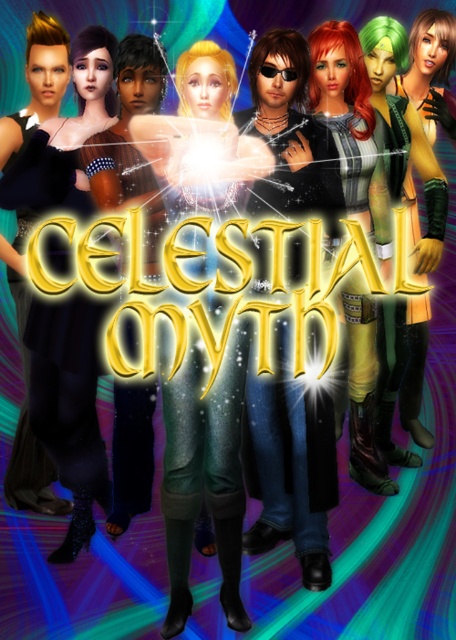
Is shiny black leather jacket at center above shiny red hair at center?

No.

Does point (316, 577) come behind point (315, 61)?

No.

Does point (305, 97) come in front of point (362, 310)?

Yes, point (305, 97) is closer to viewer.

Image resolution: width=456 pixels, height=640 pixels. Find the location of `shiny black leather jacket at center`. shiny black leather jacket at center is located at coordinates (290, 467).

Does green matte boots at center appear on the left side of shiny black leather jacket at center?

Yes, green matte boots at center is to the left of shiny black leather jacket at center.

The image size is (456, 640). What are the coordinates of `green matte boots at center` in the screenshot? It's located at (205, 476).

Is point (267, 196) less distant than point (410, 160)?

Yes, point (267, 196) is closer to viewer.

Between shiny black leather jacket at center and green matte jacket at right, which one is positioned lower?

shiny black leather jacket at center

Which is behind, point (290, 440) or point (407, 106)?

The point (407, 106) is behind.

Locate an element on the screen. The height and width of the screenshot is (640, 456). shiny black leather jacket at center is located at coordinates (290, 467).